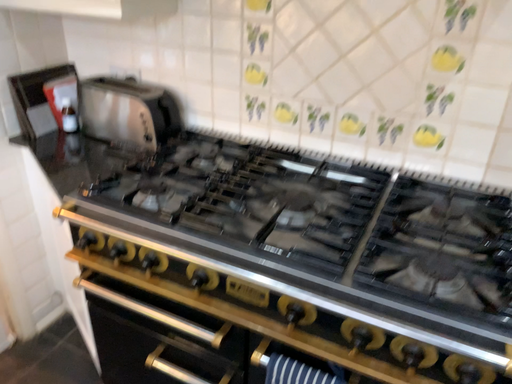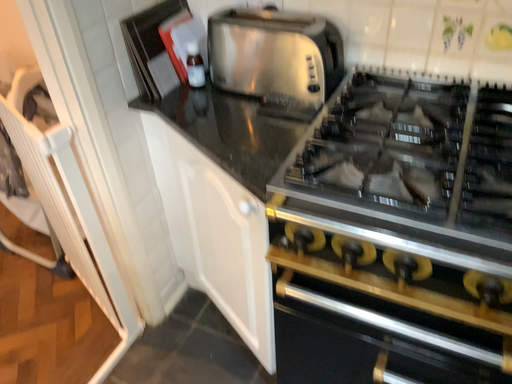
Question: Which way did the camera rotate in the video?

Choices:
 (A) rotated downward
 (B) rotated upward

Answer: (A)